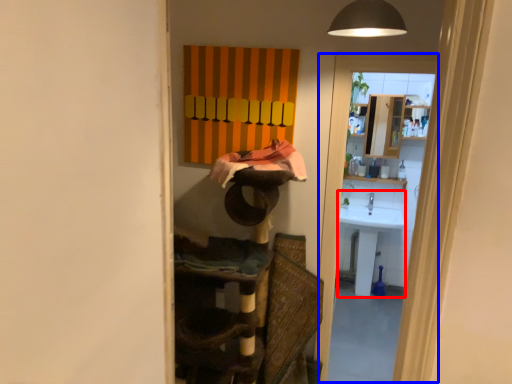
Question: Which object appears closest to the camera in this image, sink (highlighted by a red box) or screen door (highlighted by a blue box)?

Choices:
 (A) sink
 (B) screen door

Answer: (B)